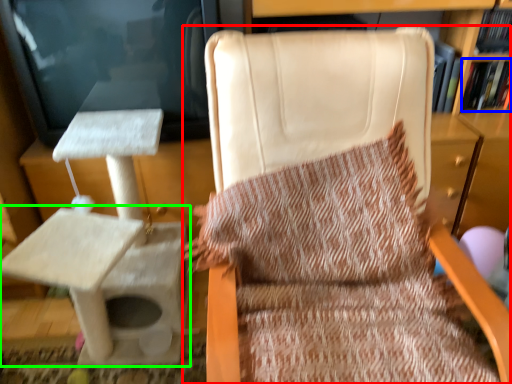
Question: Which is farther away from chair (highlighted by a red box)? book (highlighted by a blue box) or table (highlighted by a green box)?

Choices:
 (A) book
 (B) table

Answer: (A)